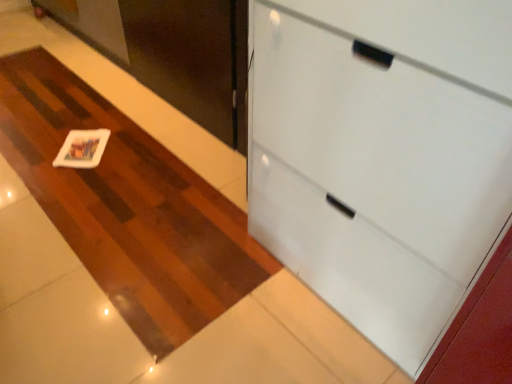
The width and height of the screenshot is (512, 384). In order to click on blank space situated above white matte coaster at center (from a real-world perspective) in this screenshot , I will do `click(96, 173)`.